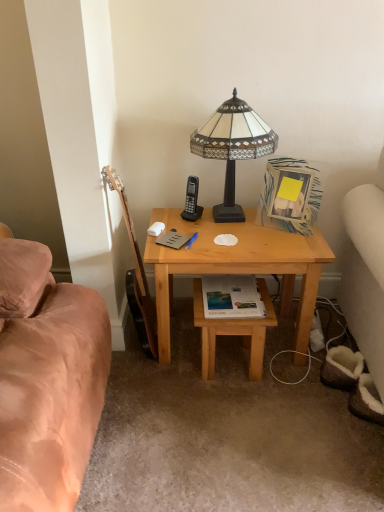
The height and width of the screenshot is (512, 384). I want to click on space that is in front of brown wood guitar at left, so click(145, 383).